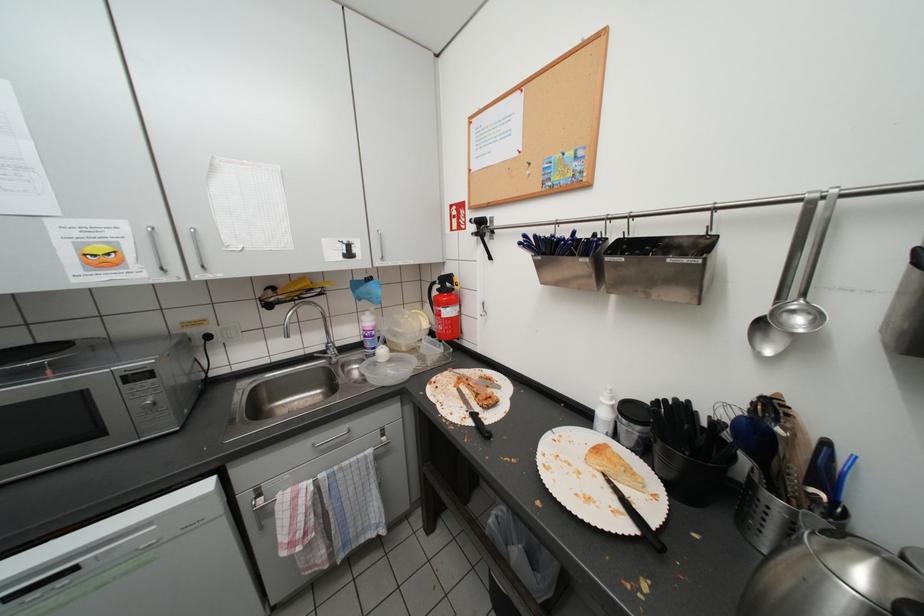
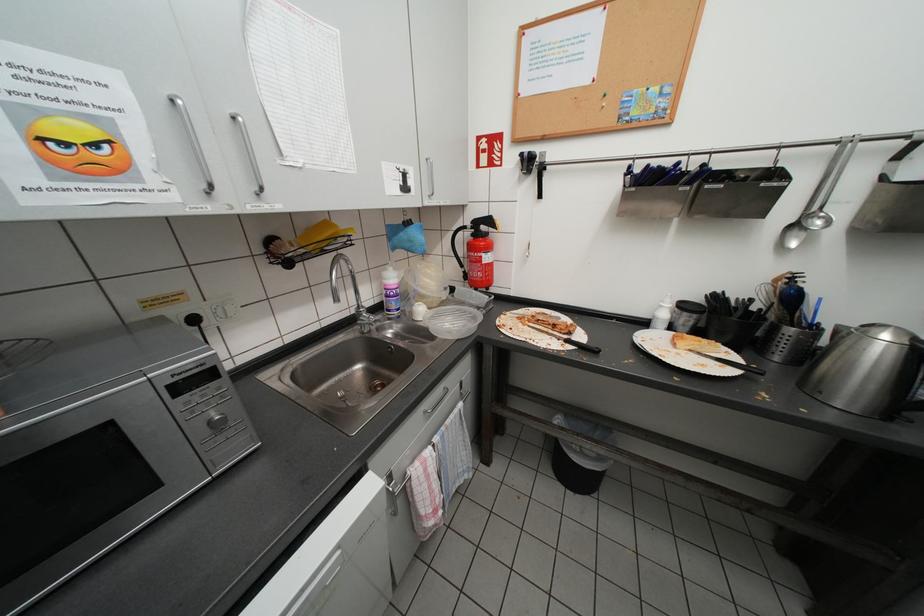
Question: The images are taken continuously from a first-person perspective. In which direction are you moving?

Choices:
 (A) Left
 (B) Right
 (C) Forward
 (D) Backward

Answer: (A)